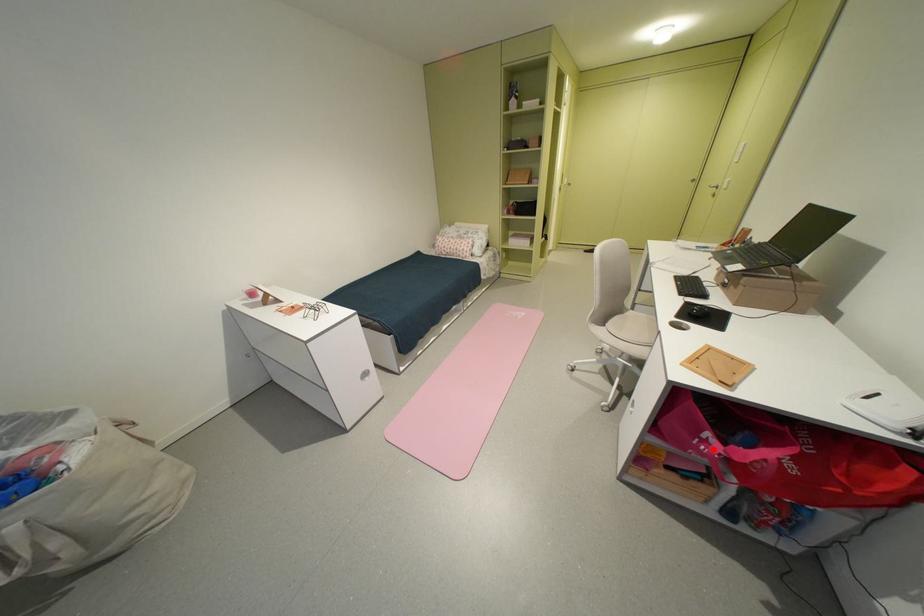
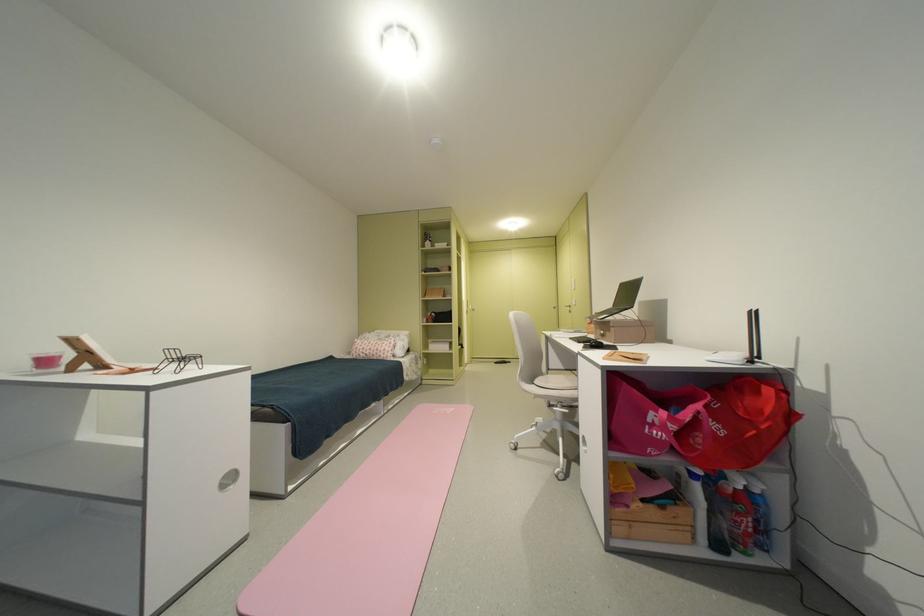
Find the pixel in the second image that matches the highlighted location in the first image.

(665, 432)